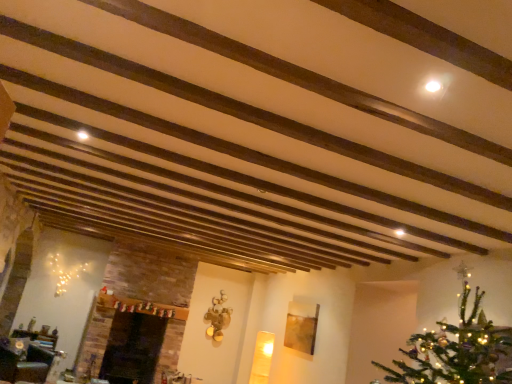
Question: Can you confirm if wooden coffee table at lower left is shorter than black glossy fireplace at lower left?

Choices:
 (A) yes
 (B) no

Answer: (A)

Question: Can you confirm if wooden coffee table at lower left is taller than black glossy fireplace at lower left?

Choices:
 (A) yes
 (B) no

Answer: (B)

Question: Can you confirm if wooden coffee table at lower left is positioned to the left of black glossy fireplace at lower left?

Choices:
 (A) no
 (B) yes

Answer: (B)

Question: Considering the relative positions of wooden coffee table at lower left and black glossy fireplace at lower left in the image provided, is wooden coffee table at lower left behind black glossy fireplace at lower left?

Choices:
 (A) no
 (B) yes

Answer: (A)

Question: Considering the relative sizes of wooden coffee table at lower left and black glossy fireplace at lower left in the image provided, is wooden coffee table at lower left thinner than black glossy fireplace at lower left?

Choices:
 (A) yes
 (B) no

Answer: (A)

Question: Is wooden coffee table at lower left closer to camera compared to black glossy fireplace at lower left?

Choices:
 (A) no
 (B) yes

Answer: (B)

Question: Is black glossy fireplace at lower left facing towards wooden coffee table at lower left?

Choices:
 (A) yes
 (B) no

Answer: (B)

Question: Is black glossy fireplace at lower left in front of wooden coffee table at lower left?

Choices:
 (A) yes
 (B) no

Answer: (B)

Question: Is black glossy fireplace at lower left smaller than wooden coffee table at lower left?

Choices:
 (A) yes
 (B) no

Answer: (B)

Question: Is black glossy fireplace at lower left completely or partially outside of wooden coffee table at lower left?

Choices:
 (A) yes
 (B) no

Answer: (A)

Question: Can you confirm if black glossy fireplace at lower left is thinner than wooden coffee table at lower left?

Choices:
 (A) no
 (B) yes

Answer: (A)

Question: Is black glossy fireplace at lower left far from wooden coffee table at lower left?

Choices:
 (A) no
 (B) yes

Answer: (B)

Question: Is wooden coffee table at lower left in front of or behind black glossy fireplace at lower left in the image?

Choices:
 (A) behind
 (B) front

Answer: (B)